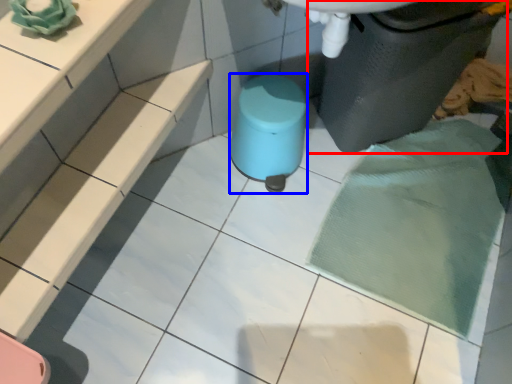
Question: Which point is further to the camera, waste container (highlighted by a red box) or stool (highlighted by a blue box)?

Choices:
 (A) waste container
 (B) stool

Answer: (B)